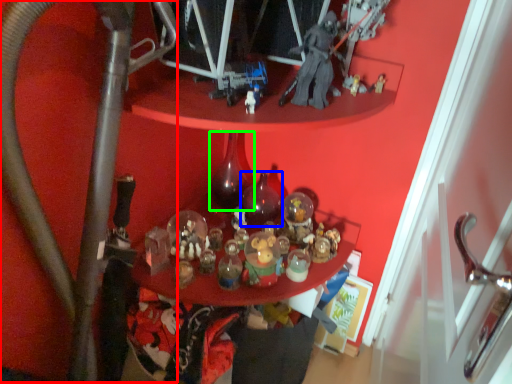
Question: Based on their relative distances, which object is nearer to water pipe (highlighted by a red box)? Choose from bottle (highlighted by a blue box) and bottle (highlighted by a green box).

Choices:
 (A) bottle
 (B) bottle

Answer: (B)